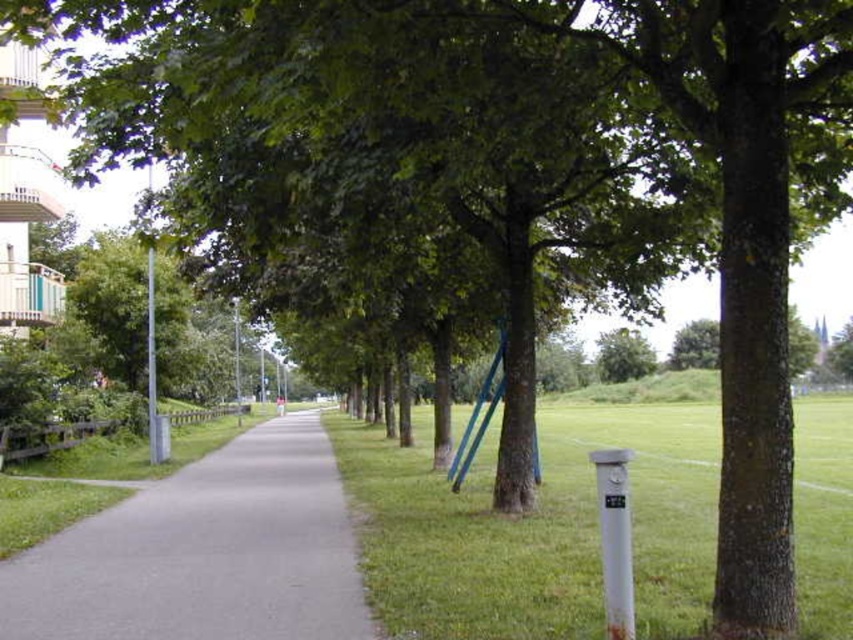
Question: Is green grass at center to the right of gray asphalt path at center from the viewer's perspective?

Choices:
 (A) no
 (B) yes

Answer: (B)

Question: Among these objects, which one is farthest from the camera?

Choices:
 (A) gray asphalt path at center
 (B) green leafy tree at center
 (C) green grass at center

Answer: (B)

Question: Is green grass at center below green leafy tree at center?

Choices:
 (A) no
 (B) yes

Answer: (B)

Question: Among these objects, which one is nearest to the camera?

Choices:
 (A) green grass at center
 (B) green leafy tree at center
 (C) gray asphalt path at center

Answer: (A)

Question: Which of the following is the farthest from the observer?

Choices:
 (A) (817, 401)
 (B) (604, 378)

Answer: (B)

Question: In this image, where is green grass at center located relative to gray asphalt path at center?

Choices:
 (A) below
 (B) above

Answer: (A)